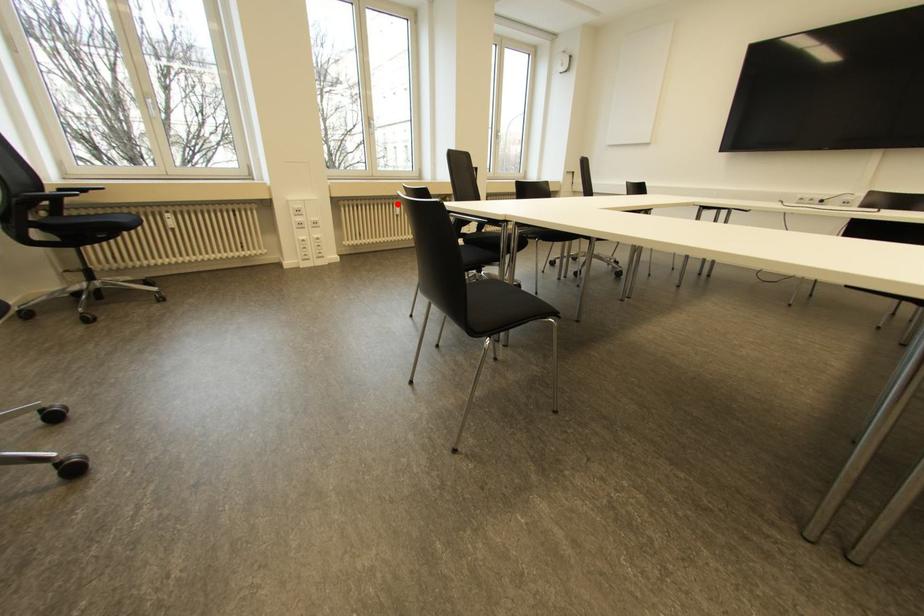
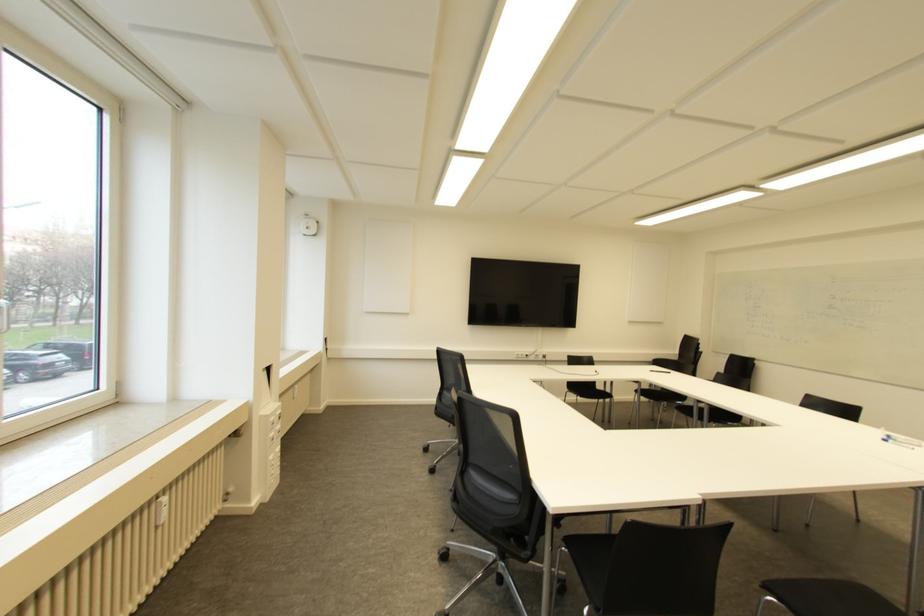
Question: I am providing you with two images of the same scene from different viewpoints. A red point is shown in image1. For the corresponding object point in image2, is it positioned nearer or farther from the camera?

Choices:
 (A) Nearer
 (B) Farther

Answer: (B)